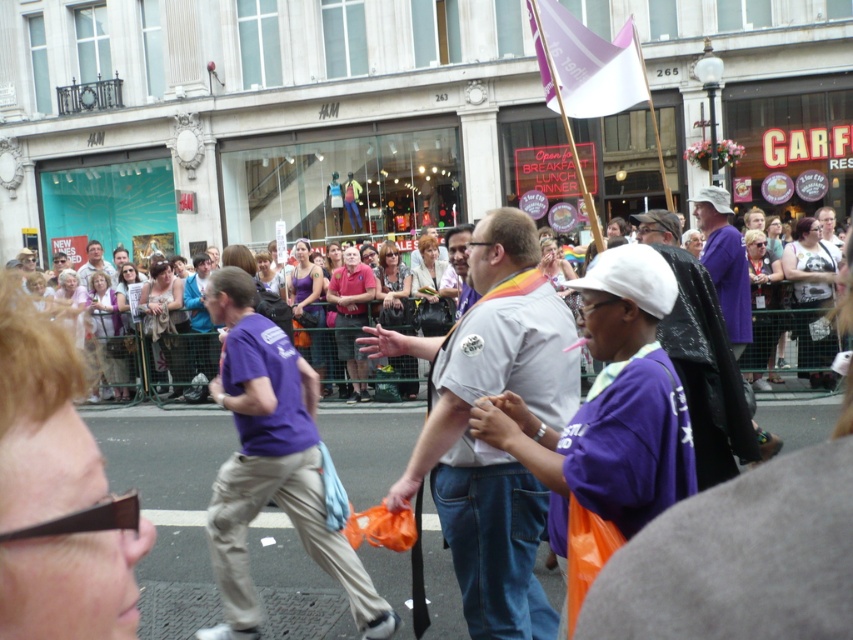
Is purple fabric flag at upper center shorter than purple fabric shirt at center?

Correct, purple fabric flag at upper center is not as tall as purple fabric shirt at center.

Looking at this image, does purple fabric flag at upper center have a greater height compared to purple fabric shirt at center?

In fact, purple fabric flag at upper center may be shorter than purple fabric shirt at center.

Between point (624, 108) and point (747, 323), which one is positioned behind?

The point (747, 323) is behind.

I want to click on purple fabric flag at upper center, so click(584, 64).

Between purple cotton shirt at center and matte purple shirt at center, which one appears on the right side from the viewer's perspective?

purple cotton shirt at center

Who is more forward, (x=308, y=515) or (x=86, y=259)?

Positioned in front is point (x=308, y=515).

Is point (250, 408) closer to viewer compared to point (91, 250)?

Yes, it is in front of point (91, 250).

At what (x,y) coordinates should I click in order to perform the action: click on purple cotton shirt at center. Please return your answer as a coordinate pair (x, y). The width and height of the screenshot is (853, 640). Looking at the image, I should click on (271, 464).

Is point (482, 381) closer to camera compared to point (560, 29)?

Yes, point (482, 381) is closer to viewer.

Does light gray shirt at center appear under purple fabric flag at upper center?

Yes, light gray shirt at center is below purple fabric flag at upper center.

Does point (456, 570) lie behind point (556, 60)?

That is False.

Find the location of a particular element. light gray shirt at center is located at coordinates (483, 442).